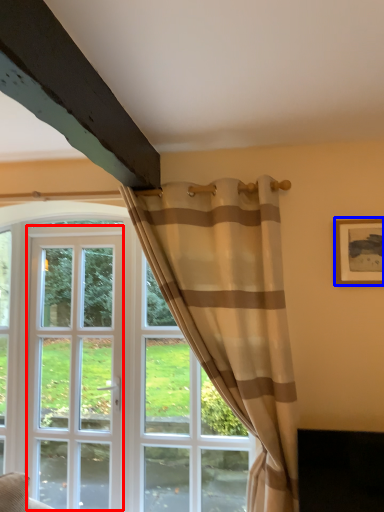
Question: Which object appears closest to the camera in this image, screen door (highlighted by a red box) or picture frame (highlighted by a blue box)?

Choices:
 (A) screen door
 (B) picture frame

Answer: (B)